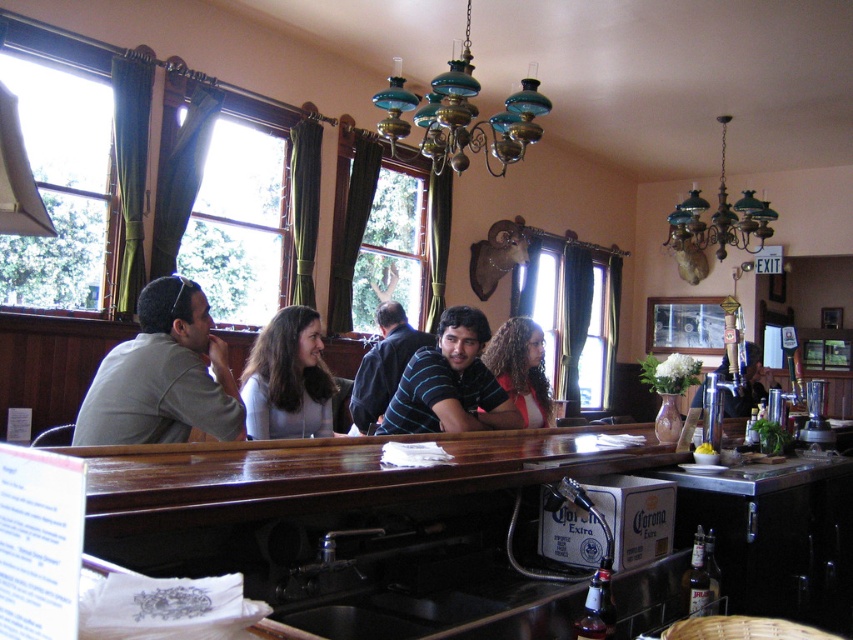
Question: Which object is the closest to the curly hair at bar?

Choices:
 (A) striped cotton shirt at center
 (B) green glass chandelier at upper center
 (C) gray cotton shirt at left
 (D) translucent glass bottle at bar front

Answer: (A)

Question: Which object is the closest to the green glass chandelier at upper center?

Choices:
 (A) gray cotton shirt at left
 (B) striped cotton shirt at center
 (C) teal glass chandelier at upper center

Answer: (C)

Question: Is striped cotton shirt at center closer to camera compared to translucent glass bottle at bar front?

Choices:
 (A) no
 (B) yes

Answer: (A)

Question: Does striped cotton shirt at center have a greater width compared to translucent glass bottle at bar front?

Choices:
 (A) yes
 (B) no

Answer: (A)

Question: Based on their relative distances, which object is farther from the green glass chandelier at upper center?

Choices:
 (A) curly hair at bar
 (B) teal glass chandelier at upper center

Answer: (A)

Question: Is teal glass chandelier at upper center further to camera compared to translucent glass bottle at bar front?

Choices:
 (A) no
 (B) yes

Answer: (B)